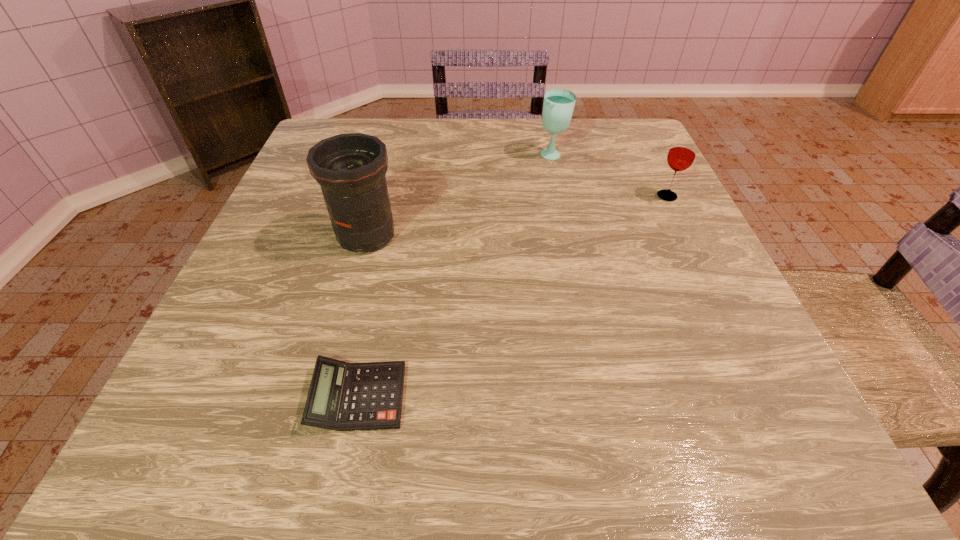
Locate an element on the screen. vacant position located 0.060m on the left of the nearer glass is located at coordinates (628, 196).

The height and width of the screenshot is (540, 960). Identify the location of free point located on the right of the shortest object. (570, 396).

At what (x,y) coordinates should I click in order to perform the action: click on object present at the far edge. Please return your answer as a coordinate pair (x, y). The image size is (960, 540). Looking at the image, I should click on (558, 106).

In order to click on object that is at the near edge in this screenshot , I will do `click(342, 396)`.

At what (x,y) coordinates should I click in order to perform the action: click on object located at the left edge. Please return your answer as a coordinate pair (x, y). This screenshot has height=540, width=960. Looking at the image, I should click on (350, 168).

At what (x,y) coordinates should I click in order to perform the action: click on object present at the right edge. Please return your answer as a coordinate pair (x, y). Looking at the image, I should click on 682,153.

In the image, there is a desktop. Where is `vacant space at the far edge`? vacant space at the far edge is located at coordinates (420, 129).

The image size is (960, 540). I want to click on free spot at the near edge of the desktop, so click(574, 447).

Image resolution: width=960 pixels, height=540 pixels. Identify the location of vacant space at the left edge. (256, 266).

Where is `free region at the right edge of the desktop`? free region at the right edge of the desktop is located at coordinates (681, 335).